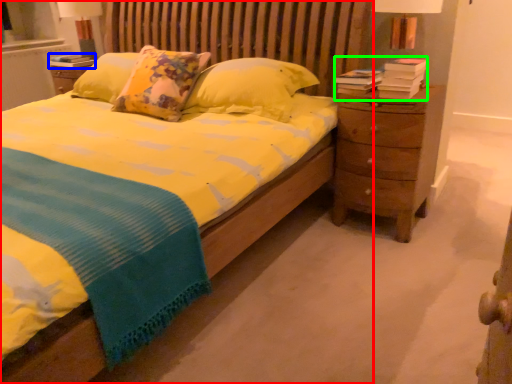
Question: Which object is positioned closest to bed (highlighted by a red box)? Select from book (highlighted by a blue box) and book (highlighted by a green box).

Choices:
 (A) book
 (B) book

Answer: (B)